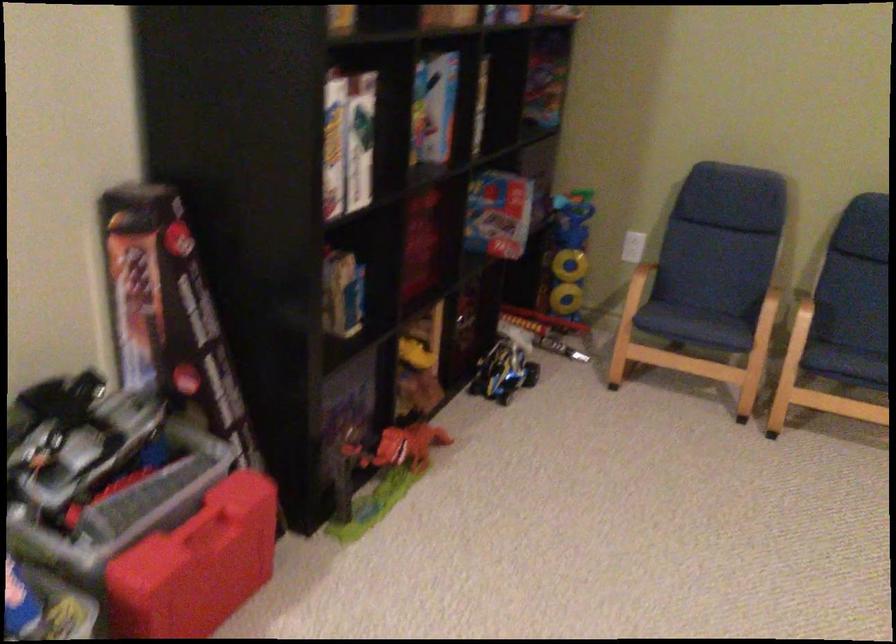
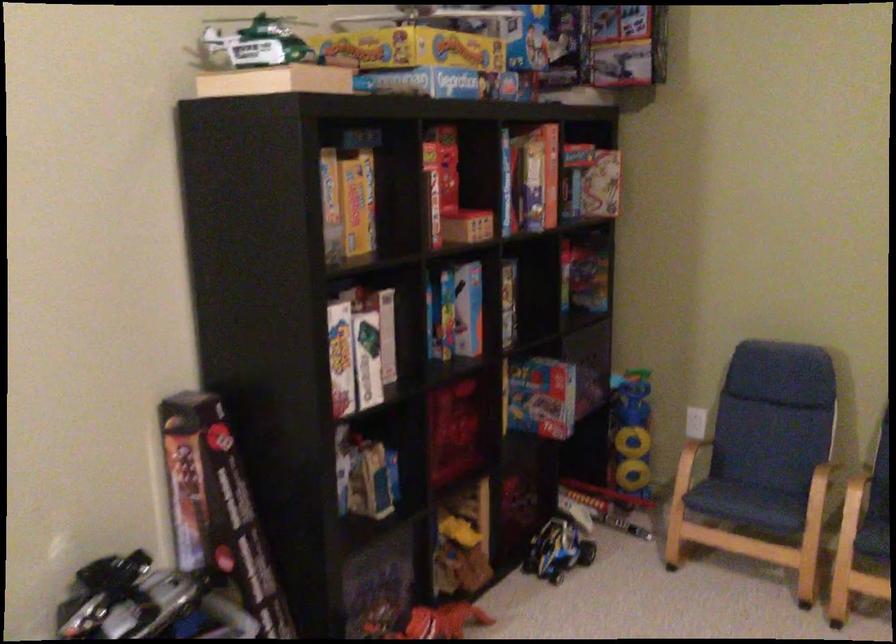
Find the pixel in the second image that matches (x=506, y=372) in the first image.

(557, 550)